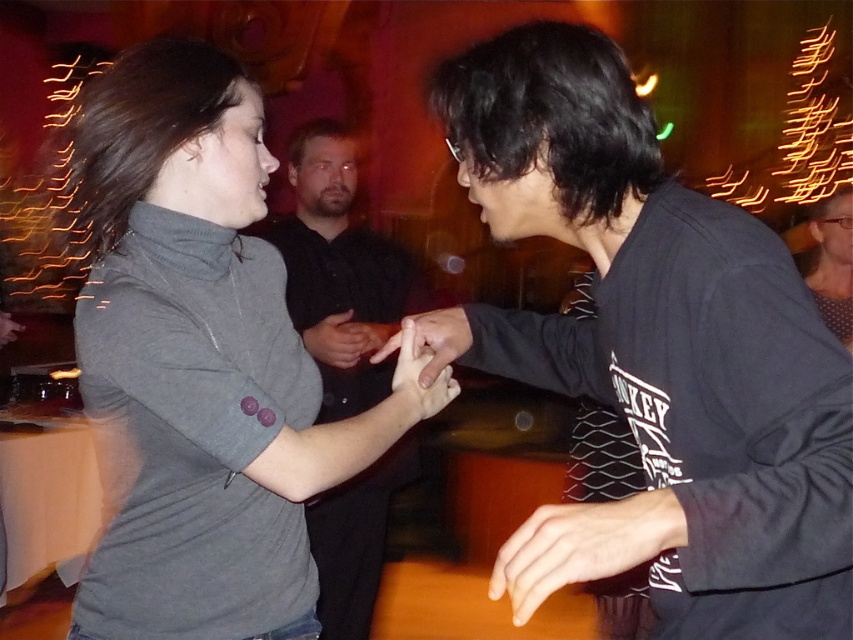
Can you confirm if smooth skin hand at center is thinner than matte gray hand at center?

In fact, smooth skin hand at center might be wider than matte gray hand at center.

Is smooth skin hand at center shorter than matte gray hand at center?

Correct, smooth skin hand at center is not as tall as matte gray hand at center.

I want to click on smooth skin hand at center, so pyautogui.click(x=582, y=545).

Find the location of a particular element. The width and height of the screenshot is (853, 640). smooth skin hand at center is located at coordinates (582, 545).

Describe the element at coordinates (196, 364) in the screenshot. I see `gray matte turtleneck at upper left` at that location.

The image size is (853, 640). What are the coordinates of `gray matte turtleneck at upper left` in the screenshot? It's located at (196, 364).

The width and height of the screenshot is (853, 640). In order to click on gray matte turtleneck at upper left in this screenshot , I will do `click(196, 364)`.

Does matte gray sweater at center have a greater width compared to matte gray hand at center?

Indeed, matte gray sweater at center has a greater width compared to matte gray hand at center.

The image size is (853, 640). What are the coordinates of `matte gray sweater at center` in the screenshot? It's located at (833, 262).